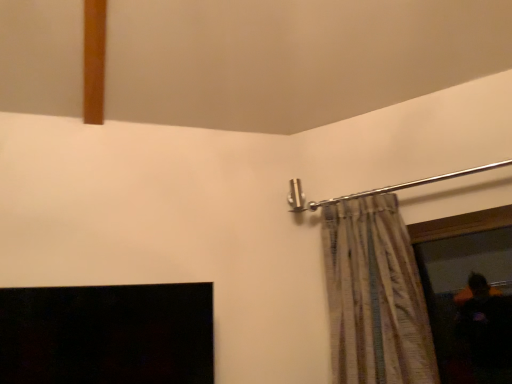
The width and height of the screenshot is (512, 384). Describe the element at coordinates (375, 296) in the screenshot. I see `striped fabric curtain at upper right` at that location.

Identify the location of striped fabric curtain at upper right. (375, 296).

In order to face striped fabric curtain at upper right, should I rotate leftwards or rightwards?

You should rotate right by 12.686 degrees.

The height and width of the screenshot is (384, 512). Describe the element at coordinates (461, 224) in the screenshot. I see `clear glass window screen at right` at that location.

You are a GUI agent. You are given a task and a screenshot of the screen. Output one action in this format:
    pyautogui.click(x=<x>, y=<y>)
    Task: Click on the clear glass window screen at right
    
    Given the screenshot: What is the action you would take?
    pyautogui.click(x=461, y=224)

The height and width of the screenshot is (384, 512). I want to click on striped fabric curtain at upper right, so click(x=375, y=296).

In the scene shown: Considering the positions of objects clear glass window screen at right and striped fabric curtain at upper right in the image provided, who is more to the right, clear glass window screen at right or striped fabric curtain at upper right?

From the viewer's perspective, clear glass window screen at right appears more on the right side.

Is clear glass window screen at right further to camera compared to striped fabric curtain at upper right?

Yes, it is.

Does point (457, 228) come farther from viewer compared to point (383, 352)?

Yes.

From the image's perspective, is clear glass window screen at right positioned above or below striped fabric curtain at upper right?

Clearly, from the image's perspective, clear glass window screen at right is below striped fabric curtain at upper right.

From a real-world perspective, who is located lower, clear glass window screen at right or striped fabric curtain at upper right?

In real-world perspective, clear glass window screen at right is lower.

Which object is thinner, clear glass window screen at right or striped fabric curtain at upper right?

Thinner between the two is clear glass window screen at right.

From their relative heights in the image, would you say clear glass window screen at right is taller or shorter than striped fabric curtain at upper right?

Clearly, clear glass window screen at right is shorter compared to striped fabric curtain at upper right.

In the scene shown: In terms of size, does clear glass window screen at right appear bigger or smaller than striped fabric curtain at upper right?

Clearly, clear glass window screen at right is smaller in size than striped fabric curtain at upper right.

In the scene shown: Would you say clear glass window screen at right is outside striped fabric curtain at upper right?

Yes, clear glass window screen at right is located beyond the bounds of striped fabric curtain at upper right.

Is clear glass window screen at right not close to striped fabric curtain at upper right?

No, clear glass window screen at right is not far away from striped fabric curtain at upper right.

Based on the photo, is clear glass window screen at right positioned with its back to striped fabric curtain at upper right?

No.

How many degrees apart are the facing directions of clear glass window screen at right and striped fabric curtain at upper right?

The angle between the facing direction of clear glass window screen at right and the facing direction of striped fabric curtain at upper right is 0.769 degrees.

At what (x,y) coordinates should I click in order to perform the action: click on window screen behind the striped fabric curtain at upper right. Please return your answer as a coordinate pair (x, y). Looking at the image, I should click on (461, 224).

In the image, is striped fabric curtain at upper right on the left side or the right side of clear glass window screen at right?

Clearly, striped fabric curtain at upper right is on the left of clear glass window screen at right in the image.

Does striped fabric curtain at upper right come behind clear glass window screen at right?

No, striped fabric curtain at upper right is in front of clear glass window screen at right.

Is point (364, 245) closer or farther from the camera than point (469, 219)?

Point (364, 245) appears to be closer to the viewer than point (469, 219).

From the image's perspective, is striped fabric curtain at upper right on clear glass window screen at right?

Yes, from the image's perspective, striped fabric curtain at upper right is above clear glass window screen at right.

From a real-world perspective, does striped fabric curtain at upper right sit lower than clear glass window screen at right?

No, from a real-world perspective, striped fabric curtain at upper right is not under clear glass window screen at right.

Which object is wider, striped fabric curtain at upper right or clear glass window screen at right?

striped fabric curtain at upper right.

Between striped fabric curtain at upper right and clear glass window screen at right, which one has less height?

Standing shorter between the two is clear glass window screen at right.

Does striped fabric curtain at upper right have a smaller size compared to clear glass window screen at right?

Incorrect, striped fabric curtain at upper right is not smaller in size than clear glass window screen at right.

Is striped fabric curtain at upper right positioned beyond the bounds of clear glass window screen at right?

Yes, striped fabric curtain at upper right is outside of clear glass window screen at right.

Is the surface of striped fabric curtain at upper right in direct contact with clear glass window screen at right?

No, striped fabric curtain at upper right is not making contact with clear glass window screen at right.

Does striped fabric curtain at upper right turn towards clear glass window screen at right?

No, striped fabric curtain at upper right is not oriented towards clear glass window screen at right.

At what (x,y) coordinates should I click in order to perform the action: click on curtain in front of the clear glass window screen at right. Please return your answer as a coordinate pair (x, y). This screenshot has width=512, height=384. Looking at the image, I should click on [375, 296].

You are a GUI agent. You are given a task and a screenshot of the screen. Output one action in this format:
    pyautogui.click(x=<x>, y=<y>)
    Task: Click on the window screen below the striped fabric curtain at upper right (from the image's perspective)
    The width and height of the screenshot is (512, 384).
    Given the screenshot: What is the action you would take?
    pyautogui.click(x=461, y=224)

I want to click on window screen behind the striped fabric curtain at upper right, so click(461, 224).